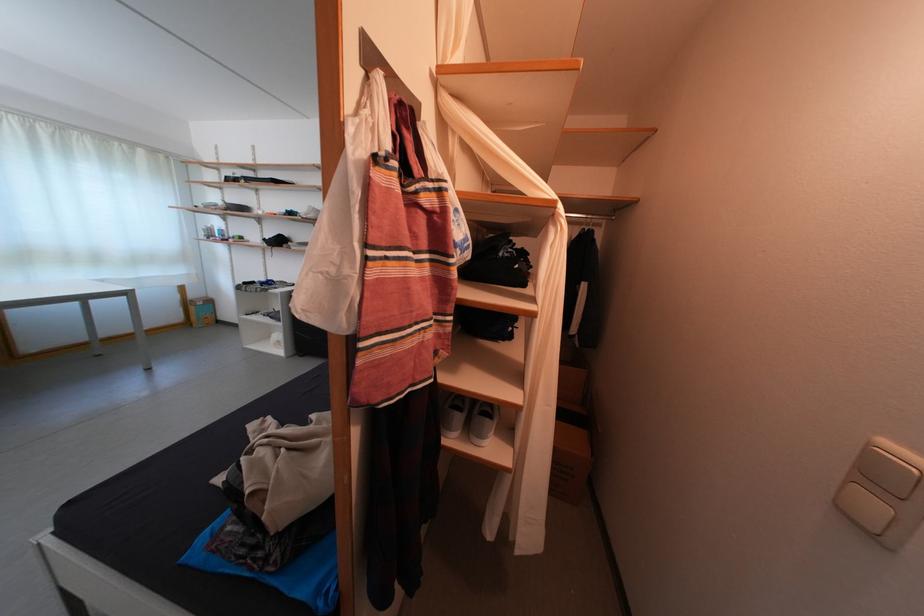
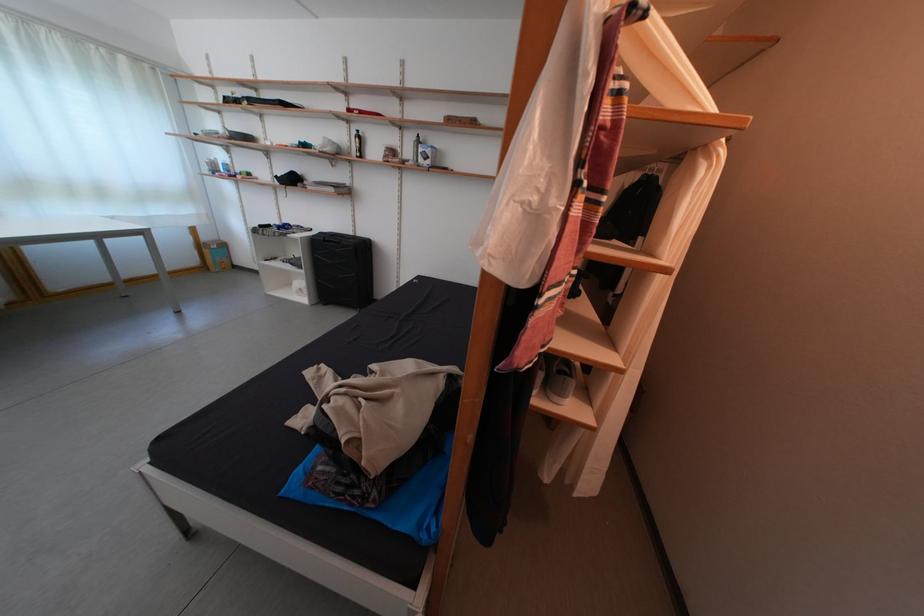
Question: The images are taken continuously from a first-person perspective. In which direction is your viewpoint rotating?

Choices:
 (A) Left
 (B) Right
 (C) Up
 (D) Down

Answer: (D)